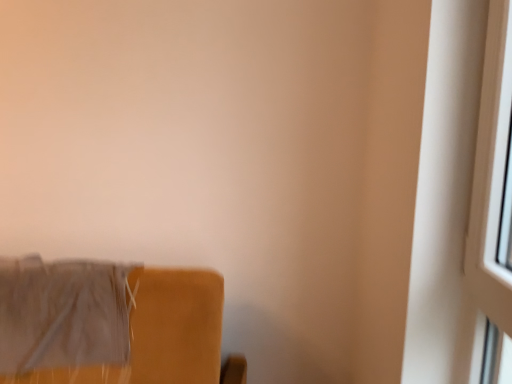
You are a GUI agent. You are given a task and a screenshot of the screen. Output one action in this format:
    pyautogui.click(x=<x>, y=<y>)
    Task: Click on the matte gray fabric at lower left
    Image resolution: width=512 pixels, height=384 pixels.
    Given the screenshot: What is the action you would take?
    pyautogui.click(x=179, y=328)

The width and height of the screenshot is (512, 384). Describe the element at coordinates (179, 328) in the screenshot. I see `matte gray fabric at lower left` at that location.

This screenshot has width=512, height=384. Identify the location of matte gray fabric at lower left. (179, 328).